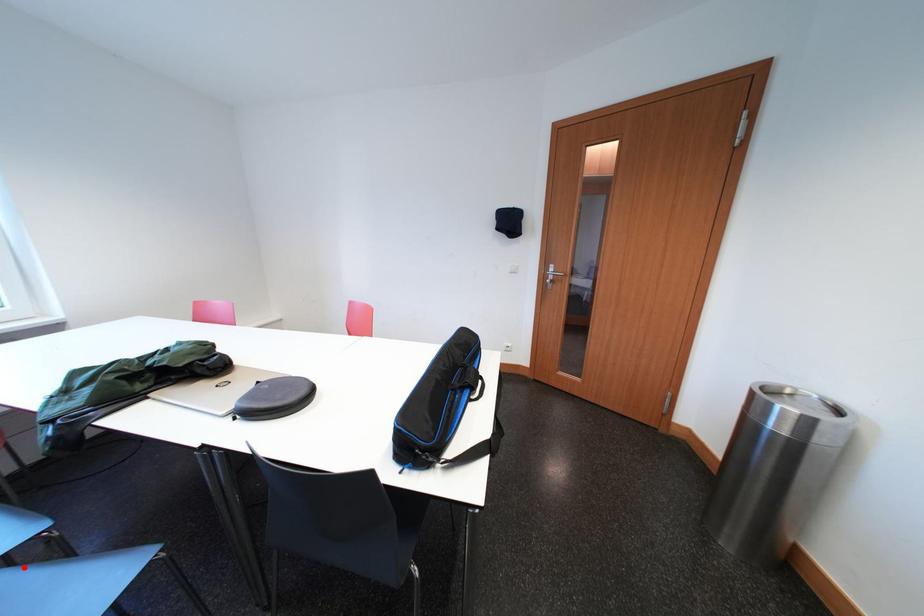
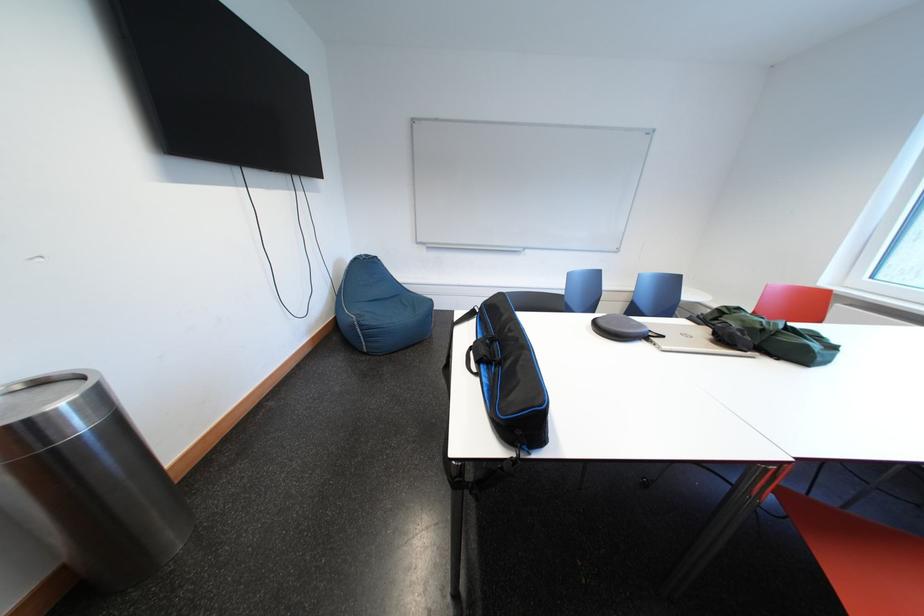
Question: I am providing you with two images of the same scene from different viewpoints. A red point is marked on the first image. Can you still see the location of the red point in image 2?

Choices:
 (A) Yes
 (B) No

Answer: (B)